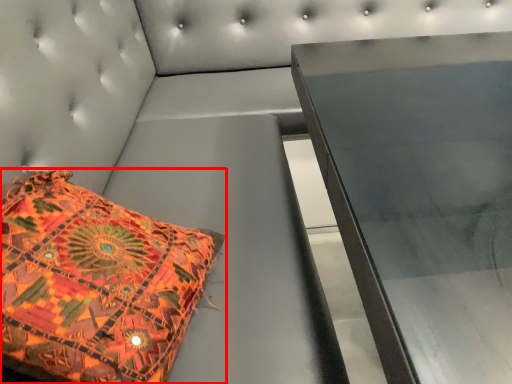
Question: In this image, where is pillow (annotated by the red box) located relative to furniture?

Choices:
 (A) left
 (B) right

Answer: (A)